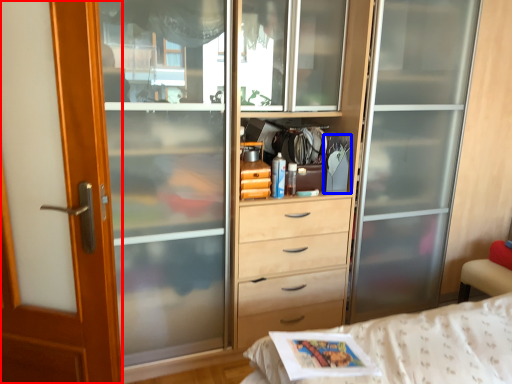
Question: Among these objects, which one is nearest to the camera, screen door (highlighted by a red box) or magazine (highlighted by a blue box)?

Choices:
 (A) screen door
 (B) magazine

Answer: (A)